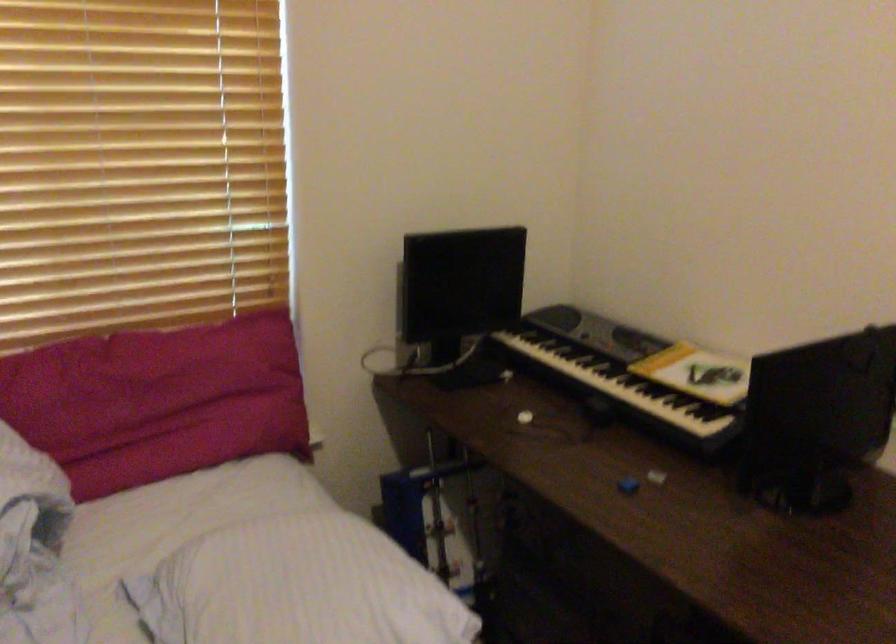
Find the location of a particular element. The height and width of the screenshot is (644, 896). blind adjustment cord is located at coordinates (416, 362).